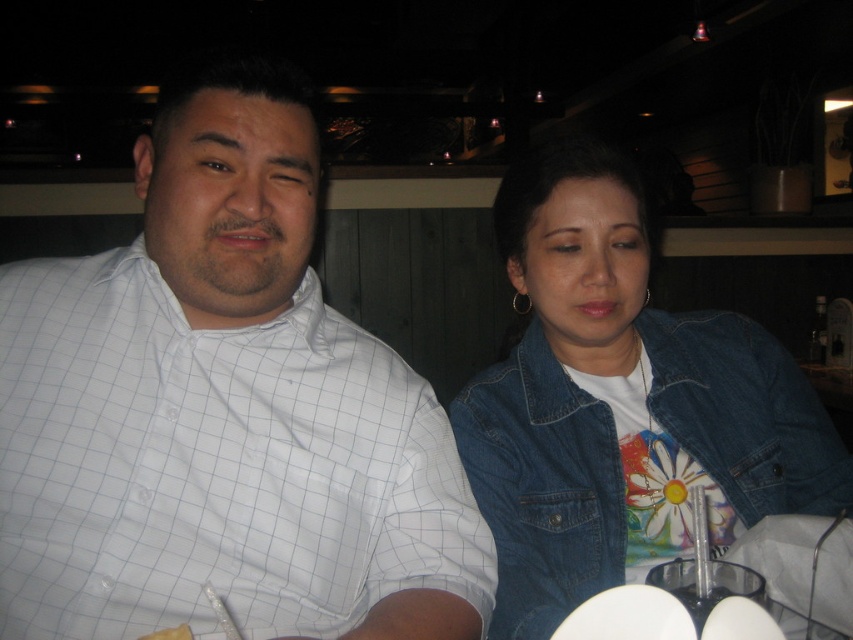
Question: Which point appears farthest from the camera in this image?

Choices:
 (A) (215, 308)
 (B) (523, 602)

Answer: (B)

Question: Does white checkered shirt at left appear on the left side of faded denim jacket at lower right?

Choices:
 (A) no
 (B) yes

Answer: (B)

Question: Does white checkered shirt at left have a smaller size compared to faded denim jacket at lower right?

Choices:
 (A) no
 (B) yes

Answer: (A)

Question: From the image, what is the correct spatial relationship of white checkered shirt at left in relation to faded denim jacket at lower right?

Choices:
 (A) above
 (B) below

Answer: (A)

Question: Which point appears farthest from the camera in this image?

Choices:
 (A) (666, 397)
 (B) (112, 497)

Answer: (A)

Question: Which point is farther to the camera?

Choices:
 (A) faded denim jacket at lower right
 (B) white checkered shirt at left

Answer: (A)